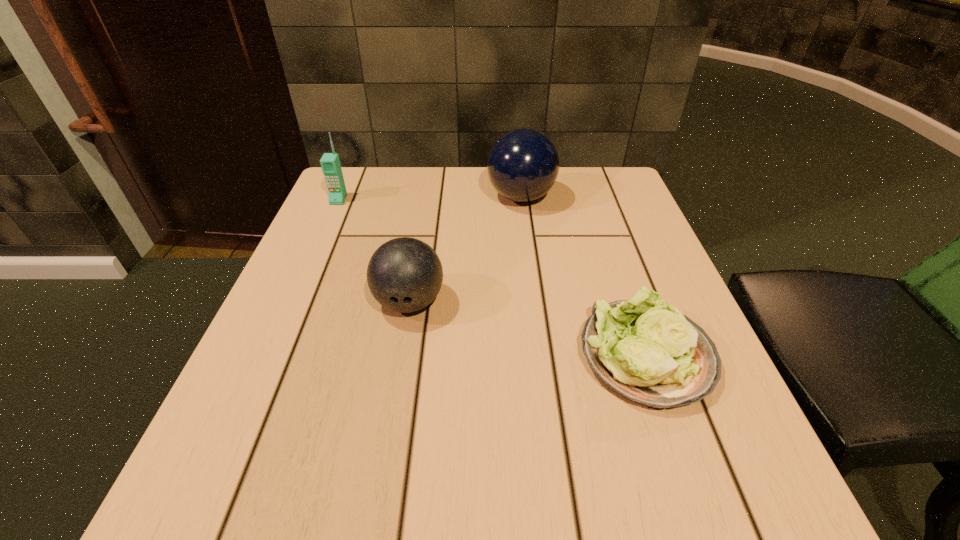
Locate an element on the screen. The image size is (960, 540). the right bowling ball is located at coordinates (523, 165).

Find the location of `the taller bowling ball`. the taller bowling ball is located at coordinates (523, 165).

Find the location of a particular element. The height and width of the screenshot is (540, 960). cellular telephone is located at coordinates (330, 163).

At what (x,y) coordinates should I click in order to perform the action: click on the nearer bowling ball. Please return your answer as a coordinate pair (x, y). The image size is (960, 540). Looking at the image, I should click on (404, 274).

This screenshot has width=960, height=540. What are the coordinates of `the left bowling ball` in the screenshot? It's located at (404, 274).

Where is `the shortest object`? the shortest object is located at coordinates (648, 352).

Identify the location of free space located on the surface of the right bowling ball near the finger holes. The image size is (960, 540). (344, 197).

Find the location of a particular element. Image resolution: width=960 pixels, height=540 pixels. free space located on the surface of the right bowling ball near the finger holes is located at coordinates (405, 197).

Identify the location of free space located 0.070m on the surface of the right bowling ball near the finger holes. (458, 197).

Find the location of a particular element. free space located on the keypad of the cellular telephone is located at coordinates (326, 227).